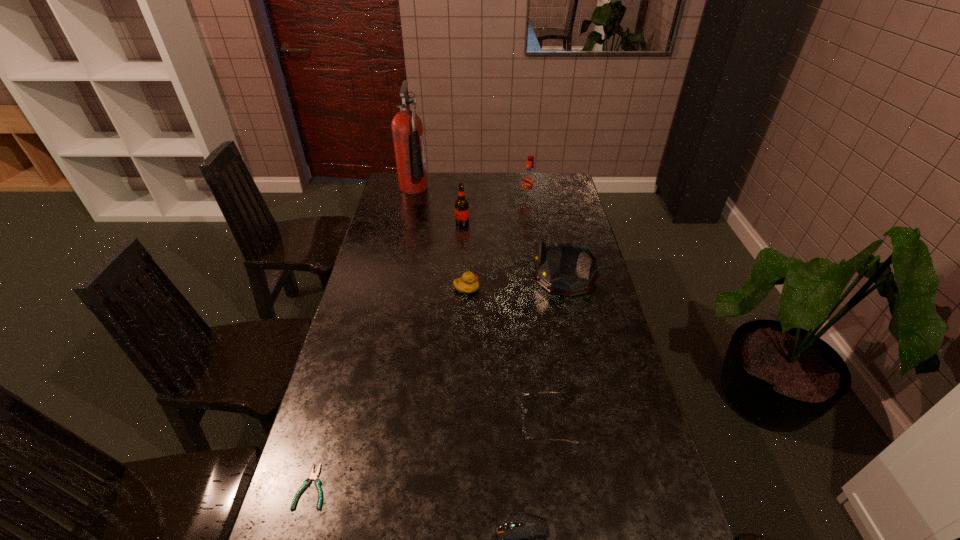
The image size is (960, 540). Identify the location of free space between the duckling and the seventh farthest object. (389, 388).

Identify the location of free area in between the seventh farthest object and the spectacles. This screenshot has width=960, height=540. (430, 455).

I want to click on free space between the tiara and the left root beer, so click(514, 250).

I want to click on free space that is in between the nearer root beer and the tiara, so click(x=514, y=250).

Locate an element on the screen. vacant area between the fifth tallest object and the tiara is located at coordinates (516, 283).

At what (x,y) coordinates should I click in order to perform the action: click on vacant area between the pliers and the tallest object. Please return your answer as a coordinate pair (x, y). The height and width of the screenshot is (540, 960). Looking at the image, I should click on (363, 337).

At what (x,y) coordinates should I click in order to perform the action: click on vacant space in between the nearer root beer and the duckling. Please return your answer as a coordinate pair (x, y). This screenshot has width=960, height=540. Looking at the image, I should click on (465, 256).

The image size is (960, 540). I want to click on free space between the pliers and the farther root beer, so click(420, 343).

At what (x,y) coordinates should I click in order to perform the action: click on the closest object to the pliers. Please return your answer as a coordinate pair (x, y). This screenshot has height=540, width=960. Looking at the image, I should click on (522, 538).

Select which object is the second closest to the second shortest object. Please provide its 2D coordinates. Your answer should be formatted as a tuple, i.e. [(x, y)], where the tuple contains the x and y coordinates of a point satisfying the conditions above.

[(313, 476)]